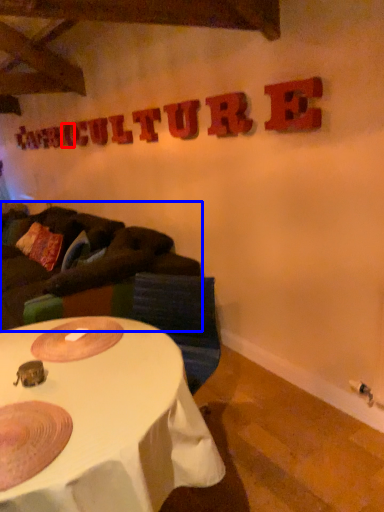
Question: Among these objects, which one is farthest to the camera, letter (highlighted by a red box) or studio couch (highlighted by a blue box)?

Choices:
 (A) letter
 (B) studio couch

Answer: (A)